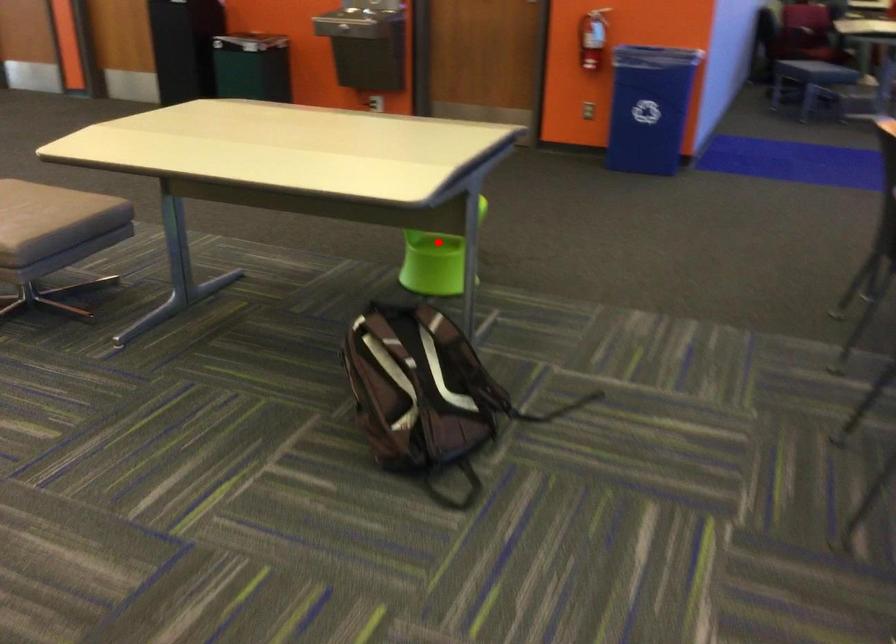
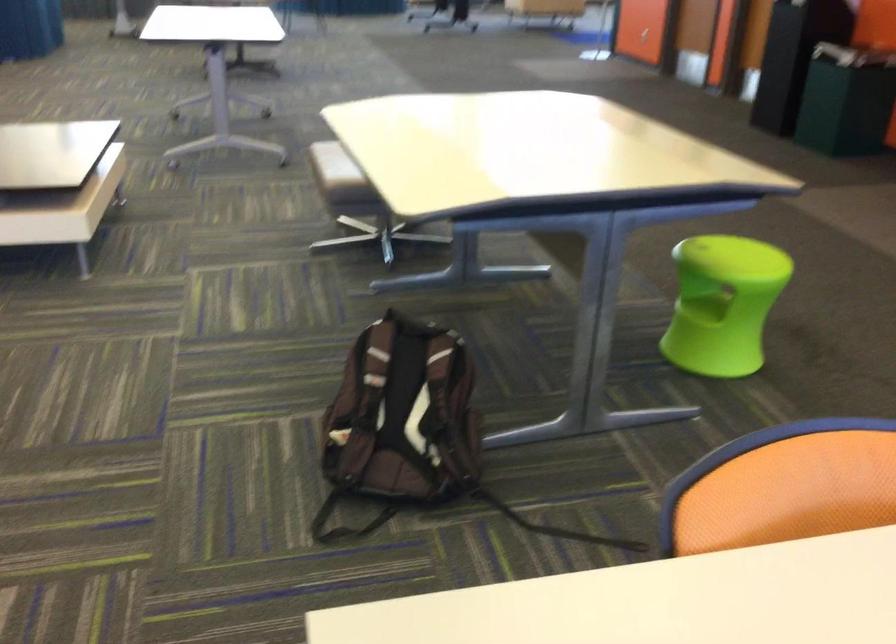
Question: I am providing you with two images of the same scene from different viewpoints. Image1 has a red point marked. In image2, the corresponding 3D location appears at what relative position? Reply with the corresponding letter.

Choices:
 (A) Closer
 (B) Farther

Answer: (A)